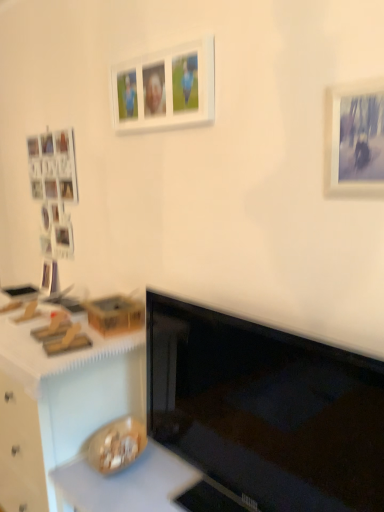
Question: Should I look upward or downward to see smooth white countertop at lower center, placed as the 1th counter top when sorted from bottom to top?

Choices:
 (A) down
 (B) up

Answer: (A)

Question: Does white matte picture frame at upper center, acting as the first picture frame starting from the back, appear on the left side of white matte counter top at lower left, arranged as the first counter top when viewed from the top?

Choices:
 (A) no
 (B) yes

Answer: (A)

Question: Does white matte picture frame at upper center, which is the 2th picture frame in right-to-left order, turn towards white matte counter top at lower left, arranged as the first counter top when viewed from the top?

Choices:
 (A) yes
 (B) no

Answer: (B)

Question: Is white matte picture frame at upper center, the first picture frame when ordered from top to bottom, positioned beyond the bounds of white matte counter top at lower left, arranged as the first counter top when viewed from the top?

Choices:
 (A) no
 (B) yes

Answer: (B)

Question: Are white matte picture frame at upper center, the 2th picture frame viewed from the front, and white matte counter top at lower left, arranged as the first counter top when viewed from the top, far apart?

Choices:
 (A) yes
 (B) no

Answer: (B)

Question: Can you confirm if white matte picture frame at upper center, the first picture frame when ordered from top to bottom, is wider than white matte counter top at lower left, arranged as the first counter top when viewed from the top?

Choices:
 (A) no
 (B) yes

Answer: (A)

Question: Is white matte picture frame at upper center, which is the 2th picture frame in right-to-left order, behind white matte counter top at lower left, arranged as the first counter top when viewed from the top?

Choices:
 (A) yes
 (B) no

Answer: (B)

Question: Can you confirm if wooden desk at lower left is bigger than black glossy monitor at center?

Choices:
 (A) yes
 (B) no

Answer: (A)

Question: Considering the relative sizes of wooden desk at lower left and black glossy monitor at center in the image provided, is wooden desk at lower left taller than black glossy monitor at center?

Choices:
 (A) no
 (B) yes

Answer: (B)

Question: Is wooden desk at lower left behind black glossy monitor at center?

Choices:
 (A) no
 (B) yes

Answer: (B)

Question: Would you say wooden desk at lower left is a long distance from black glossy monitor at center?

Choices:
 (A) yes
 (B) no

Answer: (B)

Question: Does wooden desk at lower left turn towards black glossy monitor at center?

Choices:
 (A) yes
 (B) no

Answer: (B)

Question: Is wooden desk at lower left shorter than black glossy monitor at center?

Choices:
 (A) no
 (B) yes

Answer: (A)

Question: Are white matte picture frame at upper center, which is the 2th picture frame from bottom to top, and black glossy monitor at center making contact?

Choices:
 (A) yes
 (B) no

Answer: (B)